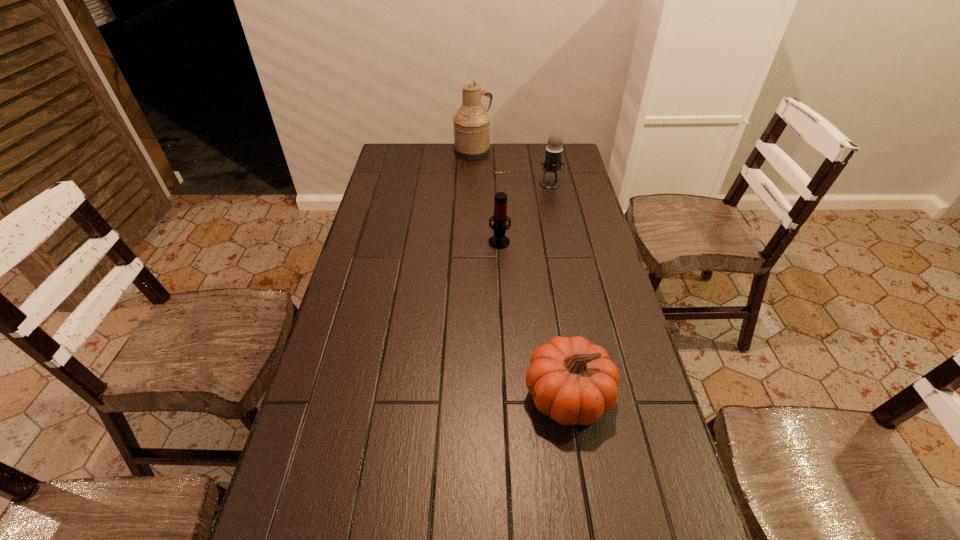
Find the location of `the tallest object`. the tallest object is located at coordinates (471, 123).

Identify the location of pitcher. This screenshot has height=540, width=960. (471, 123).

Where is `the third nearest object`? the third nearest object is located at coordinates (552, 163).

The image size is (960, 540). I want to click on the right microphone, so click(552, 163).

The height and width of the screenshot is (540, 960). Find the location of `the third farthest object`. the third farthest object is located at coordinates (499, 241).

Where is `the nearer microphone`? Image resolution: width=960 pixels, height=540 pixels. the nearer microphone is located at coordinates (499, 241).

Identify the location of pumpkin. The image size is (960, 540). (571, 380).

What are the coordinates of `vacant region located 0.210m on the front of the pitcher` in the screenshot? It's located at (472, 188).

Locate an element on the screen. This screenshot has height=540, width=960. blank space located on the back of the third nearest object is located at coordinates (546, 166).

Identify the location of free spot located 0.370m on the left of the nearer microphone. (379, 240).